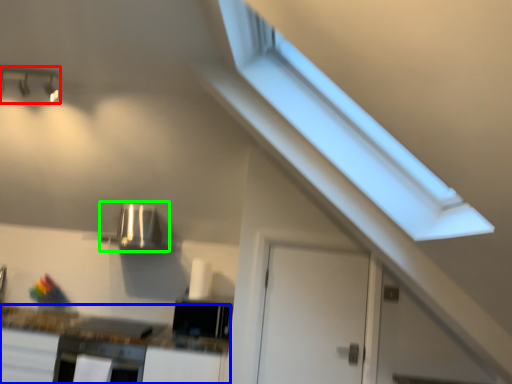
Question: Which object is positioned farthest from light fixture (highlighted by a red box)? Select from countertop (highlighted by a blue box) and appliance (highlighted by a green box).

Choices:
 (A) countertop
 (B) appliance

Answer: (A)